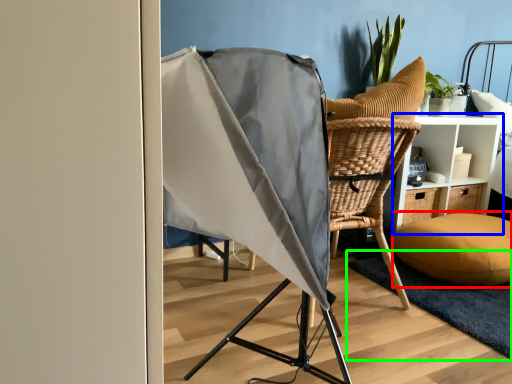
Question: Which object is positioned closest to pillow (highlighted by a red box)? Select from furniture (highlighted by a blue box) and mat (highlighted by a green box).

Choices:
 (A) furniture
 (B) mat

Answer: (B)